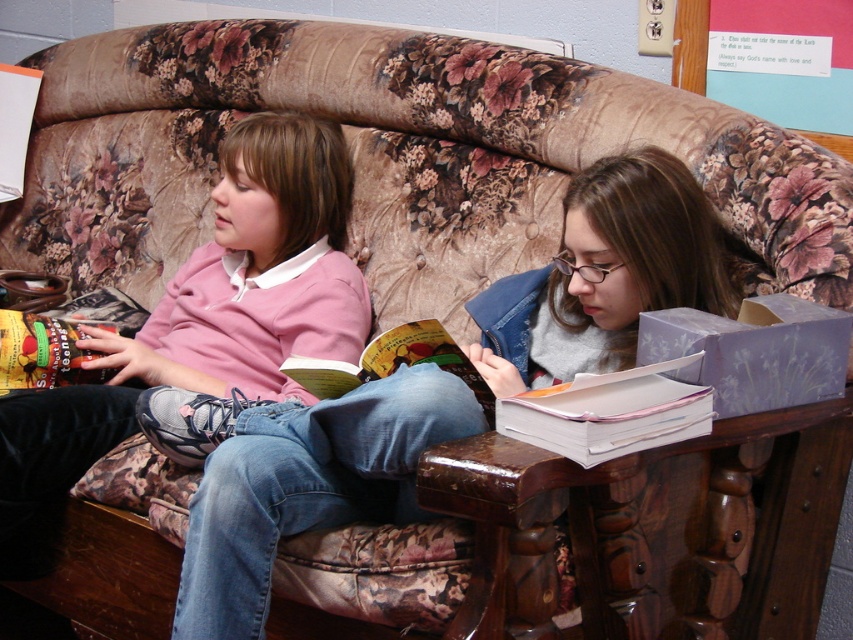
You are trying to find the white paper book at lower right. Based on the scene, where is it located relative to the hardcover book at center?

The white paper book at lower right is positioned on the right side of hardcover book at center.

You are taking a photo of two people sitting on a couch. You notice two points in the image labeled as point [346,173] and point [531,404]. Which point is closer to the camera?

Point [346,173] is closer to the camera than point [531,404].

You are a photographer trying to capture a closeup of the white paper book at lower right without the pink cotton shirt at left blocking the view. Based on their sizes, do you think the shirt will block the book in the photo?

The pink cotton shirt at left might be wider than the white paper book at lower right, so there is a possibility that the shirt could block the view of the book in the photo.